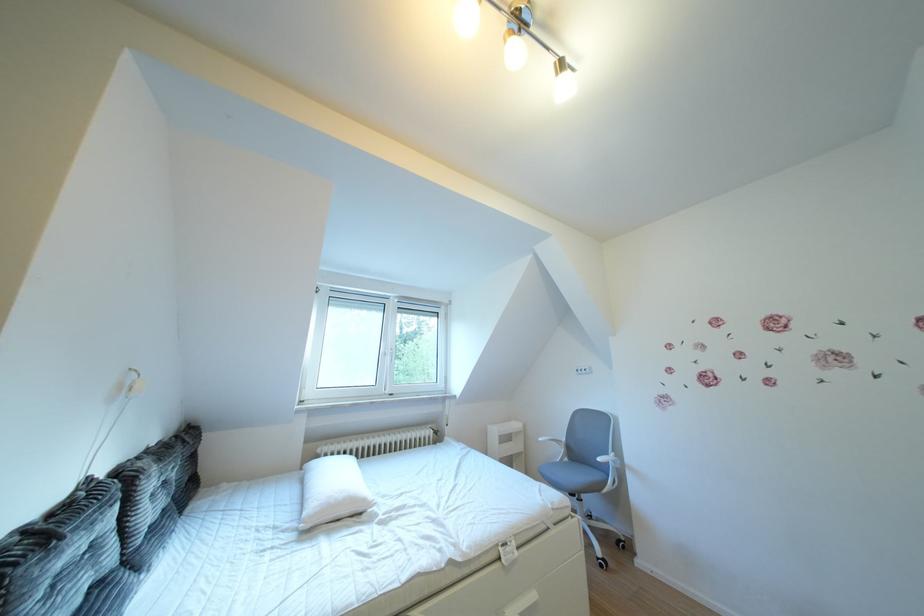
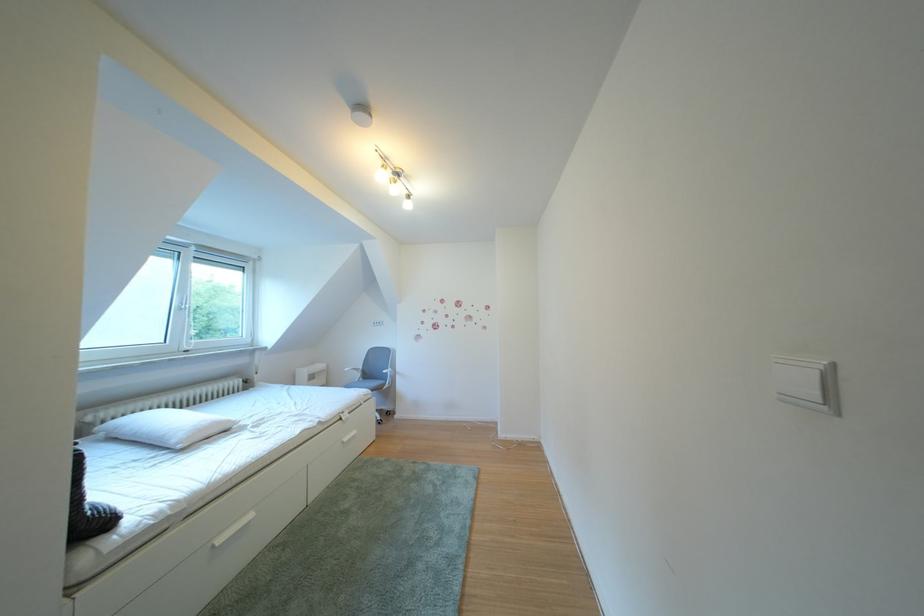
The point at (333, 456) is marked in the first image. Where is the corresponding point in the second image?

(103, 424)